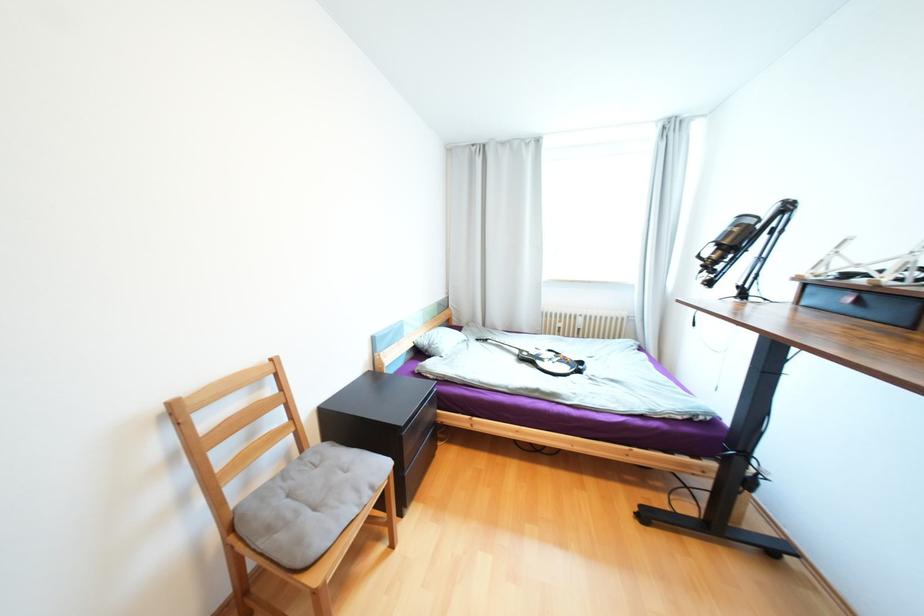
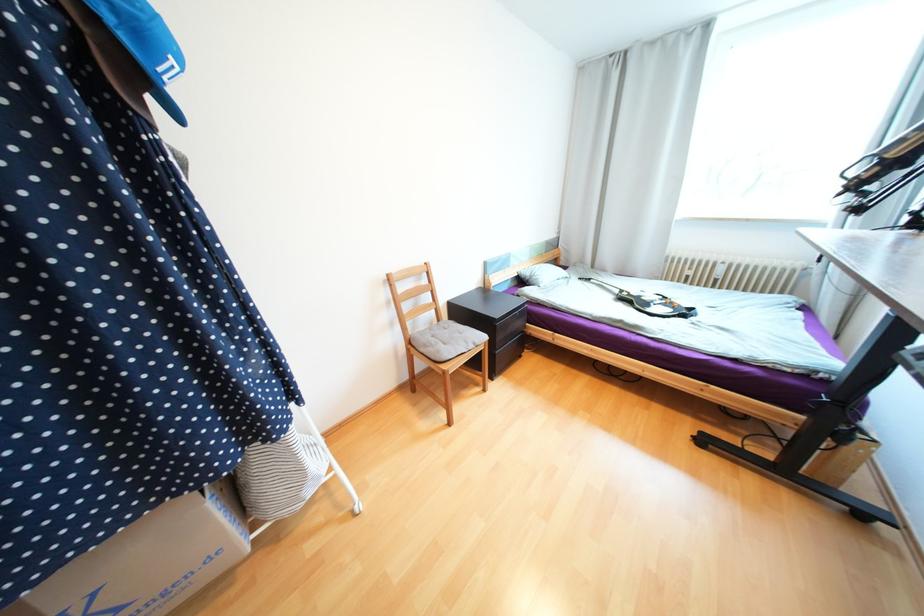
In the second image, find the point that corresponds to point (523, 352) in the first image.

(623, 292)